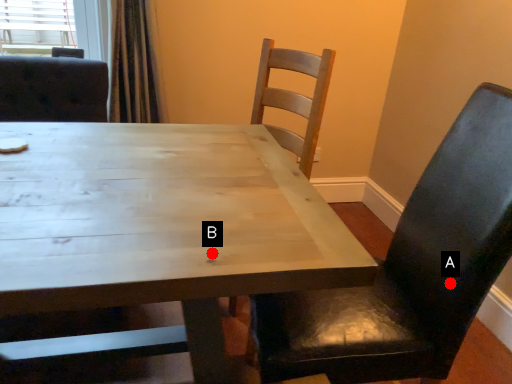
Question: Two points are circled on the image, labeled by A and B beside each circle. Which point appears farthest from the camera in this image?

Choices:
 (A) A is further
 (B) B is further

Answer: (A)